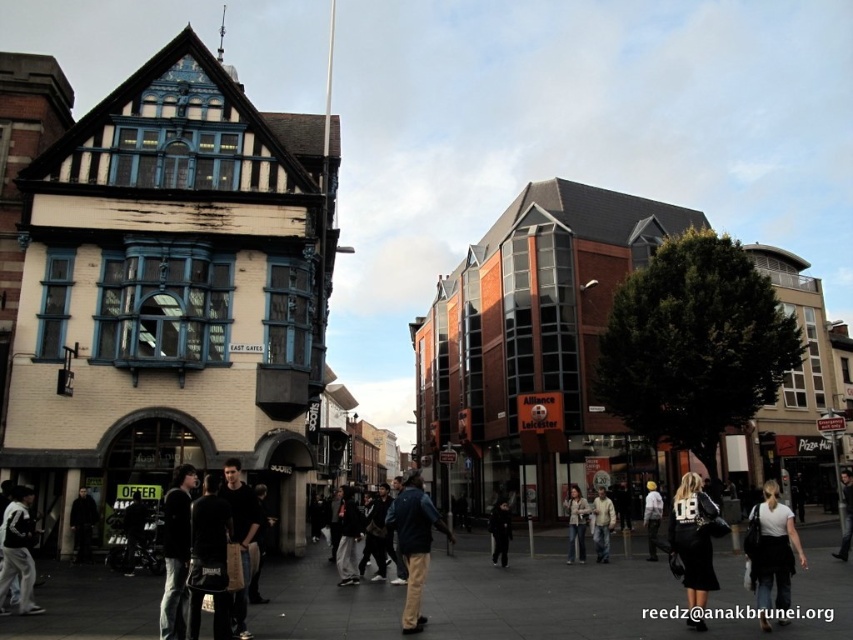
You are a delivery person needing to place a package between the white cotton jacket at lower left and the light brown leather jacket at center. The package requires a space of 40 meters. Is the distance sufficient?

The white cotton jacket at lower left and the light brown leather jacket at center are 40.86 meters apart, so yes, the distance is sufficient to place the package requiring 40 meters between them.

You are a street vendor trying to set up a stall between the dark blue jacket at lower left and the denim jacket at center. Since the space between them is 1.2 meters, can your 1.5 meter wide cart fit there?

The dark blue jacket at lower left is bigger than the denim jacket at center, but the space between them is 1.2 meters. Since your cart is 1.5 meters wide, it cannot fit in the 1.2 meter space between the dark blue jacket at lower left and the denim jacket at center.

You are a delivery person trying to deliver a package to the East Gates building. You see a dark blue jacket at lower left and a denim jacket at center. Which jacket is closer to the building entrance?

The dark blue jacket at lower left is positioned over the denim jacket at center, meaning it is closer to the building entrance.